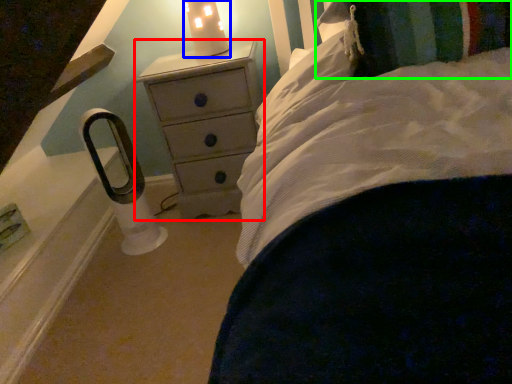
Question: Which object is positioned farthest from chest of drawers (highlighted by a red box)? Select from candle holder (highlighted by a blue box) and pillow (highlighted by a green box).

Choices:
 (A) candle holder
 (B) pillow

Answer: (B)